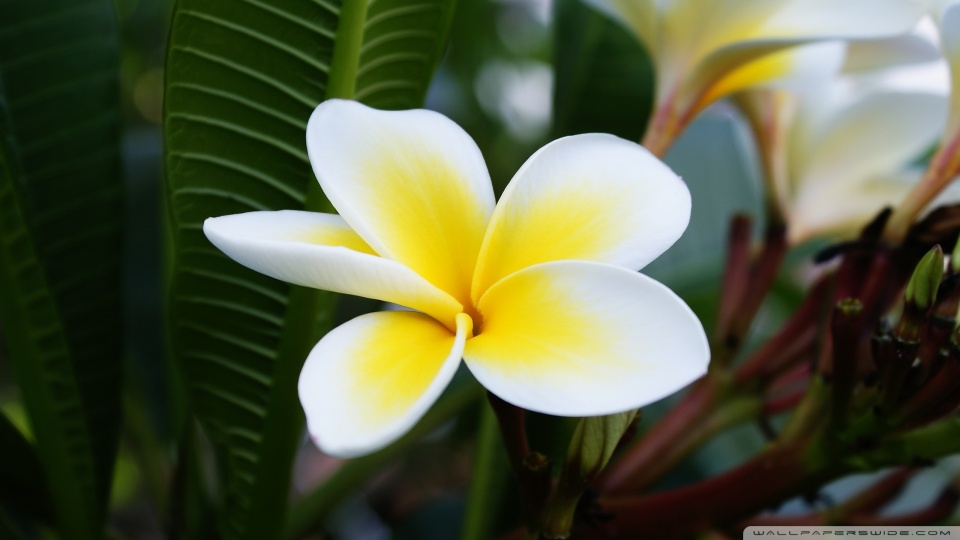
I want to click on plant, so click(x=260, y=507), click(x=85, y=485), click(x=468, y=514), click(x=586, y=505).